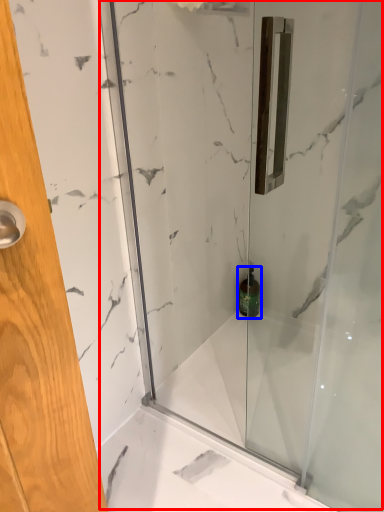
Question: Which object is further to the camera taking this photo, shower door (highlighted by a red box) or toiletry (highlighted by a blue box)?

Choices:
 (A) shower door
 (B) toiletry

Answer: (B)